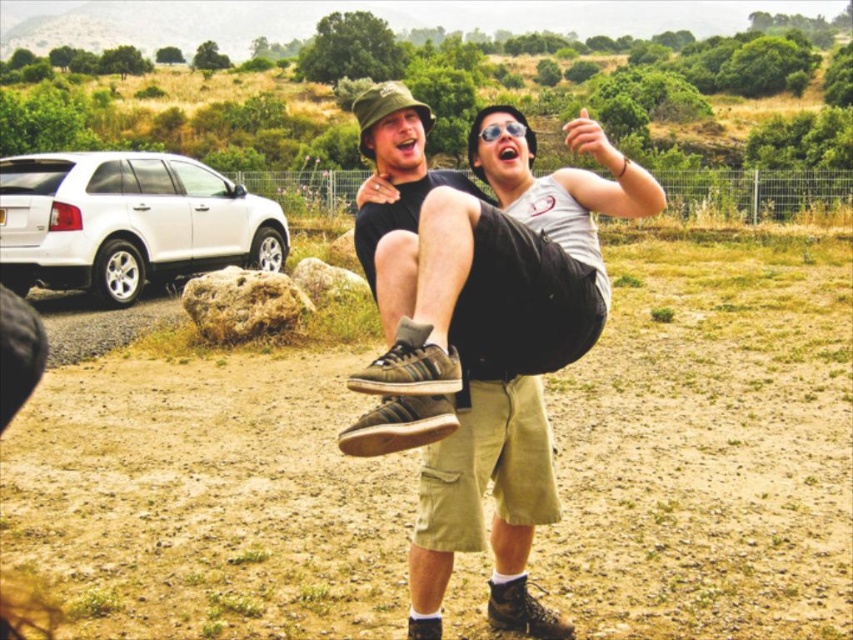
Question: Does matte black shorts at center appear under white matte suv at left?

Choices:
 (A) no
 (B) yes

Answer: (B)

Question: Among these objects, which one is nearest to the camera?

Choices:
 (A) brown sandy ground at center
 (B) white matte suv at left

Answer: (A)

Question: Is brown sandy ground at center further to camera compared to white matte suv at left?

Choices:
 (A) no
 (B) yes

Answer: (A)

Question: Estimate the real-world distances between objects in this image. Which object is farther from the white matte suv at left?

Choices:
 (A) brown sandy ground at center
 (B) matte black shorts at center

Answer: (B)

Question: Does brown sandy ground at center appear over matte black shorts at center?

Choices:
 (A) yes
 (B) no

Answer: (B)

Question: Which of the following is the closest to the observer?

Choices:
 (A) matte black shorts at center
 (B) white matte suv at left

Answer: (A)